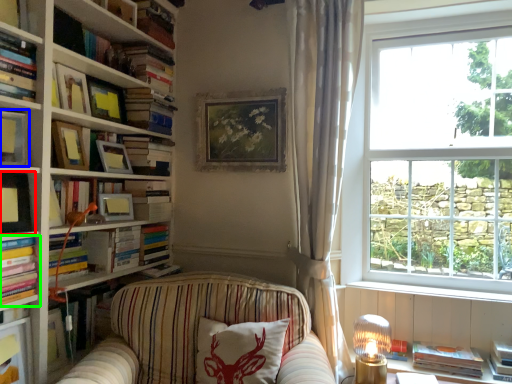
Question: Estimate the real-world distances between objects in this image. Which object is farther from book (highlighted by a red box), book (highlighted by a blue box) or book (highlighted by a green box)?

Choices:
 (A) book
 (B) book

Answer: (A)